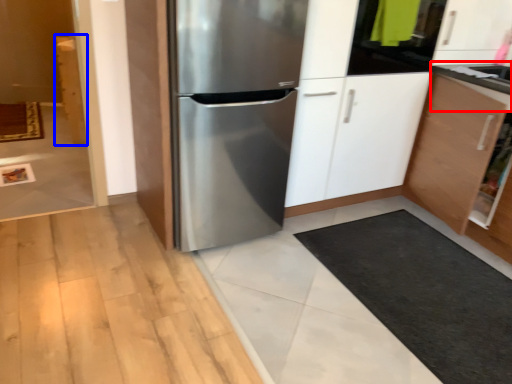
Question: Which object is closer to the camera taking this photo, counter top (highlighted by a red box) or cabinetry (highlighted by a blue box)?

Choices:
 (A) counter top
 (B) cabinetry

Answer: (A)